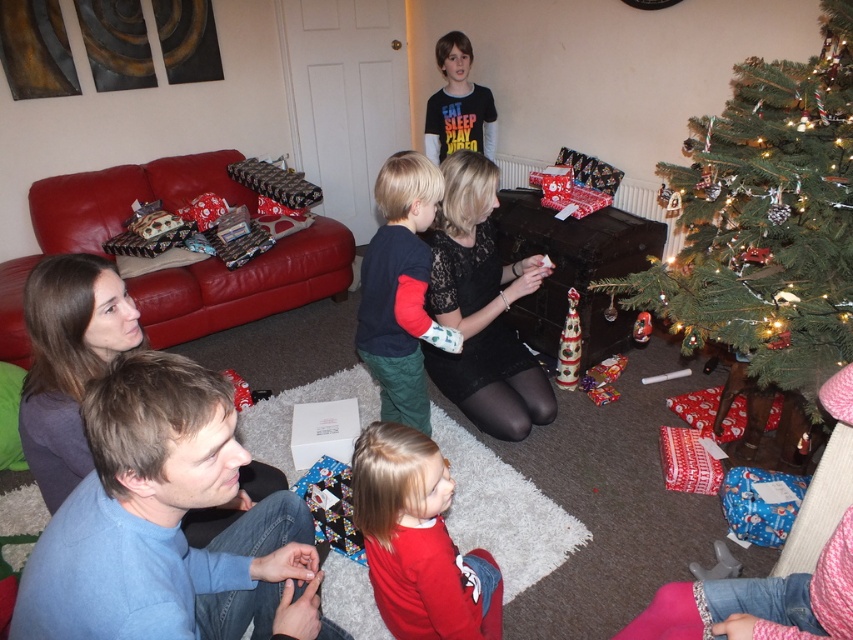
You are a photographer trying to capture a candid shot of the dark blue fleece shirt at center and the black matte shirt at upper center. Which one will appear larger in your photo?

The dark blue fleece shirt at center will appear larger in the photo because it is closer to the viewer than the black matte shirt at upper center.

You are standing in the living room and want to take a photo of both point (427, 406) and point (460, 104). Which point should you focus on first to ensure both are in focus?

You should focus on point (427, 406) first because it is closer to the camera than point (460, 104), ensuring both will be in focus when using depth of field.

You are standing in the living room and want to walk from point A to point B. Point A is at coordinates point (425, 625) and point B is at coordinates point (486, 152). Which direction should you walk to move from point A to point B?

To move from point A to point B, you should walk towards the direction where point A is in front of point B, so you need to move backward or in the opposite direction relative to your current position.